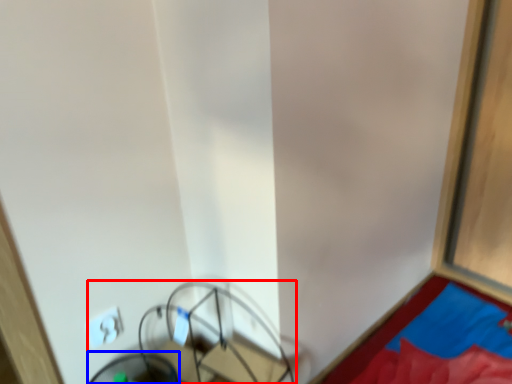
Question: Among these objects, which one is nearest to the camera, furniture (highlighted by a red box) or swivel chair (highlighted by a blue box)?

Choices:
 (A) furniture
 (B) swivel chair

Answer: (A)